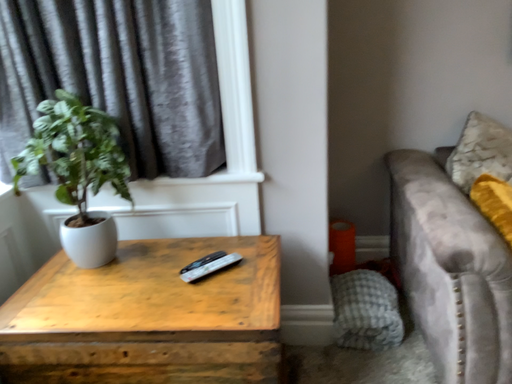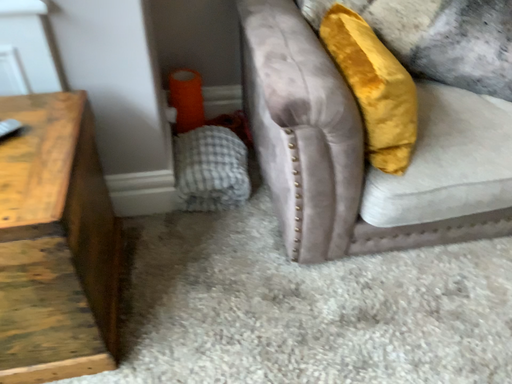
Question: Which way did the camera rotate in the video?

Choices:
 (A) rotated left
 (B) rotated right

Answer: (B)